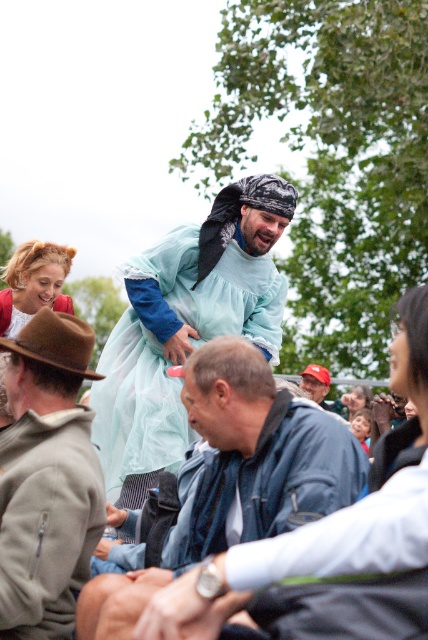
Does denim jacket at center have a greater height compared to blonde hair wig at upper left?

Yes.

Who is more forward, (315, 410) or (12, 276)?

Point (315, 410)

The width and height of the screenshot is (428, 640). I want to click on denim jacket at center, so (x=238, y=474).

Between blonde hair wig at upper left and red cap at center, which one has more height?

With more height is blonde hair wig at upper left.

Is blonde hair wig at upper left closer to the viewer compared to red cap at center?

Yes, it is.

Locate an element on the screen. This screenshot has height=640, width=428. blonde hair wig at upper left is located at coordinates (33, 284).

Is light blue fabric dress at center below brown suede hat at left?

No, light blue fabric dress at center is not below brown suede hat at left.

This screenshot has width=428, height=640. I want to click on light blue fabric dress at center, so click(x=186, y=326).